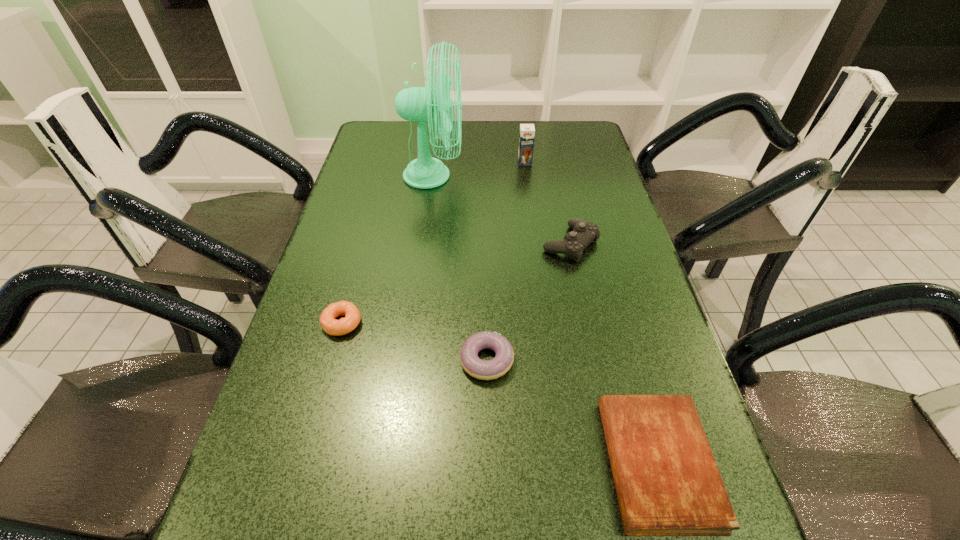
You are a GUI agent. You are given a task and a screenshot of the screen. Output one action in this format:
    pyautogui.click(x=<x>, y=<y>)
    Task: Click on the fifth object from right to left
    The image size is (960, 540).
    Given the screenshot: What is the action you would take?
    pyautogui.click(x=417, y=104)

Identify the location of the tallest object. This screenshot has height=540, width=960. (417, 104).

Where is `chocolate milk`? This screenshot has width=960, height=540. chocolate milk is located at coordinates (527, 131).

Where is `control`? control is located at coordinates (584, 232).

What are the coordinates of `the third farthest object` in the screenshot? It's located at (x=584, y=232).

Locate an element on the screen. Image resolution: width=960 pixels, height=540 pixels. the fourth object from right to left is located at coordinates (481, 369).

At what (x,y) coordinates should I click in order to perform the action: click on Bible. Please return your answer as a coordinate pair (x, y). Looking at the image, I should click on tap(667, 481).

The height and width of the screenshot is (540, 960). I want to click on the left doughnut, so click(328, 323).

Locate an element on the screen. Image resolution: width=960 pixels, height=540 pixels. vacant space situated in front of the fifth object from right to left to blow air is located at coordinates (503, 176).

Locate an element on the screen. Image resolution: width=960 pixels, height=540 pixels. free space located 0.230m on the front label of the chocolate milk is located at coordinates (531, 210).